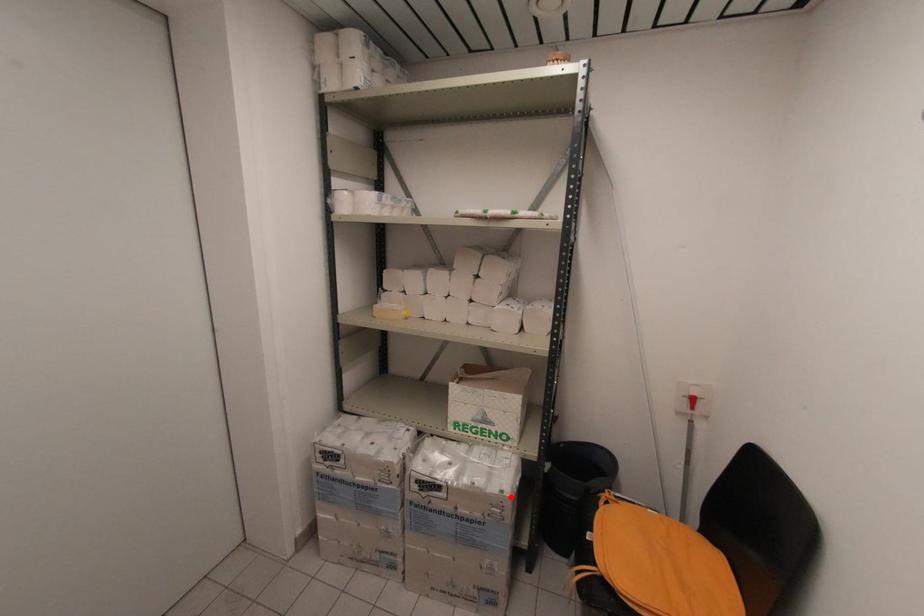
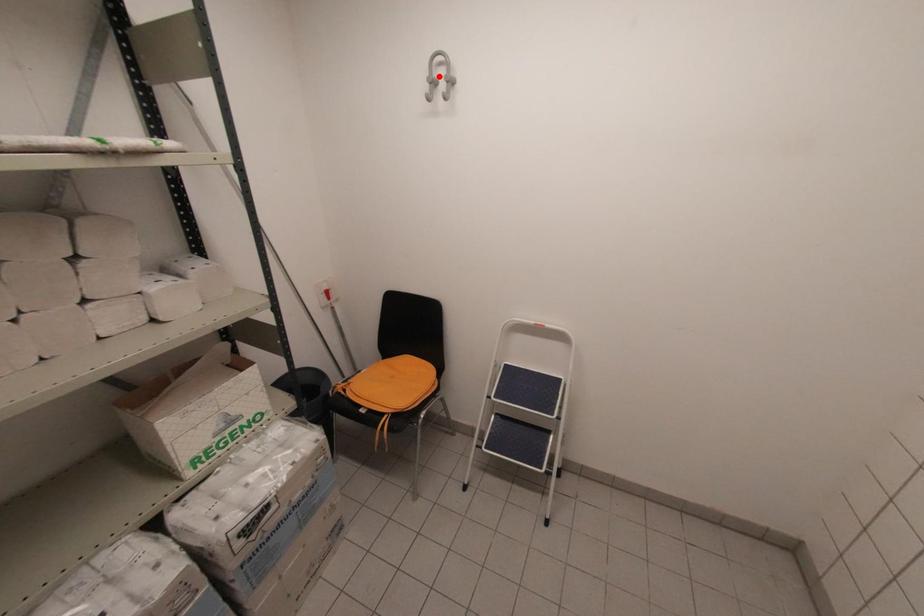
I am providing you with two images of the same scene from different viewpoints. A red point is marked on the first image and another point is marked on the second image. Does the point marked in image1 correspond to the same location as the one in image2?

No